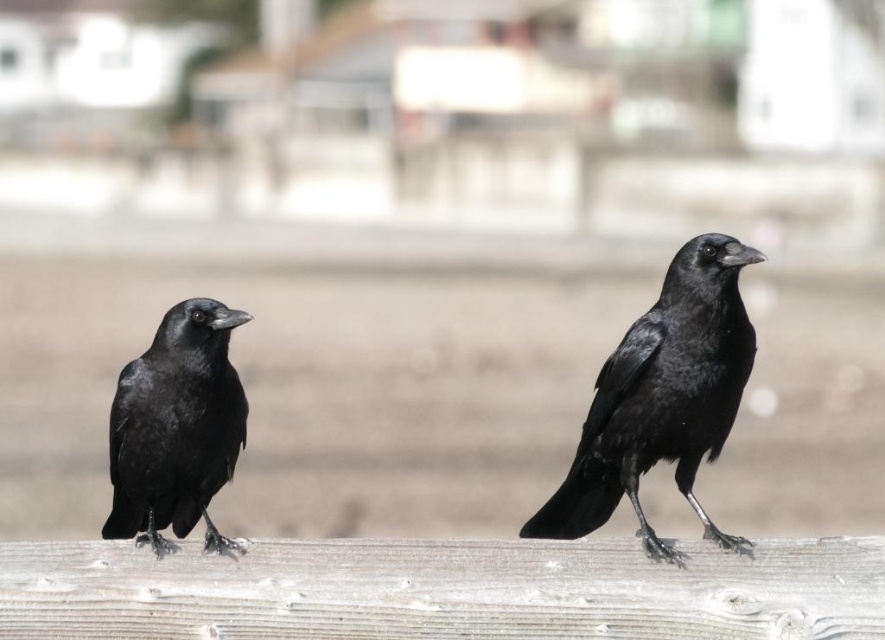
Question: Is matte black raven at center closer to camera compared to matte black raven at left?

Choices:
 (A) no
 (B) yes

Answer: (B)

Question: Is matte black raven at center in front of matte black raven at left?

Choices:
 (A) yes
 (B) no

Answer: (A)

Question: Which of the following is the farthest from the observer?

Choices:
 (A) click(x=127, y=481)
 (B) click(x=655, y=461)

Answer: (B)

Question: Which of the following is the closest to the observer?

Choices:
 (A) (202, 496)
 (B) (720, 337)

Answer: (B)

Question: Observing the image, what is the correct spatial positioning of matte black raven at center in reference to matte black raven at left?

Choices:
 (A) above
 (B) below

Answer: (A)